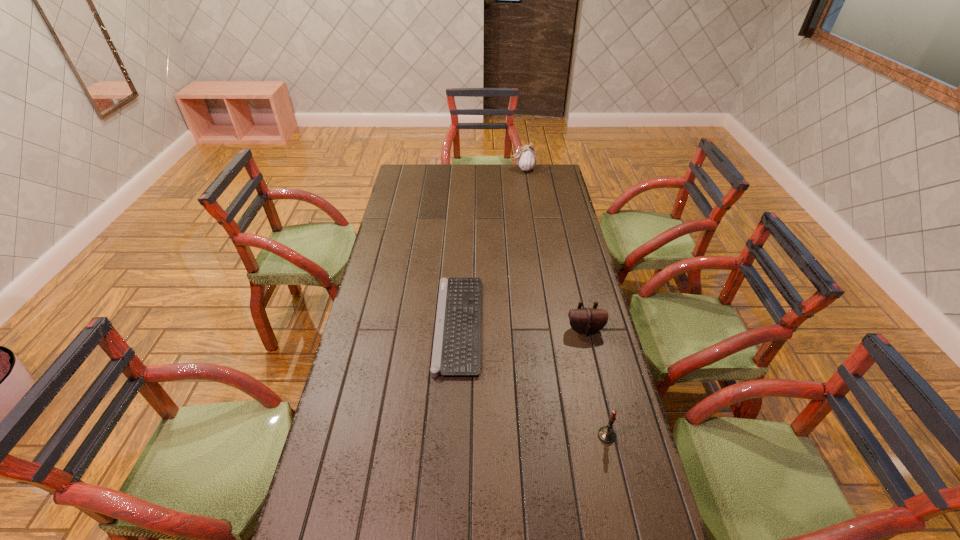
Where is `free space at the far right corner`? The image size is (960, 540). free space at the far right corner is located at coordinates (540, 169).

Locate an element on the screen. free space between the candle and the taller pouch is located at coordinates (564, 302).

The image size is (960, 540). In order to click on vacant area between the nearer pouch and the shortest object in this screenshot , I will do `click(521, 327)`.

I want to click on vacant space that's between the leftmost object and the left pouch, so click(491, 247).

Locate an element on the screen. free space between the nearer pouch and the shortest object is located at coordinates (521, 327).

Locate an element on the screen. vacant region between the shorter pouch and the computer keyboard is located at coordinates 521,327.

At what (x,y) coordinates should I click in order to perform the action: click on free point between the nearer pouch and the computer keyboard. Please return your answer as a coordinate pair (x, y). Looking at the image, I should click on (521, 327).

Image resolution: width=960 pixels, height=540 pixels. I want to click on vacant space that's between the candle and the farther pouch, so click(x=564, y=302).

Where is `vacant area between the shortest object and the tallest object`? Image resolution: width=960 pixels, height=540 pixels. vacant area between the shortest object and the tallest object is located at coordinates (491, 247).

Locate an element on the screen. free space between the candle and the computer keyboard is located at coordinates (533, 380).